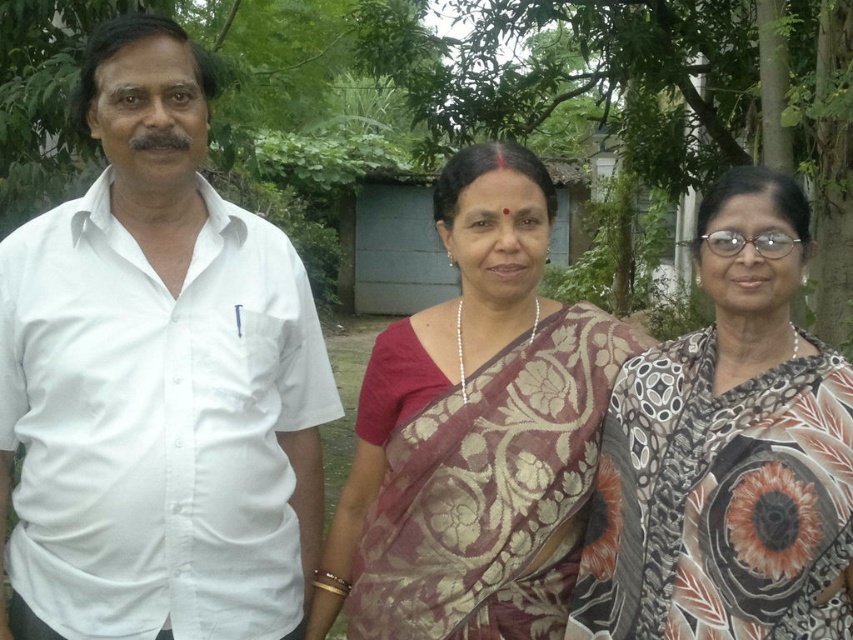
How far apart are maroon floral saree at center and green leafy tree at center?

maroon floral saree at center is 26.50 feet from green leafy tree at center.

Can you confirm if maroon floral saree at center is bigger than green leafy tree at center?

Yes.

Is point (495, 204) positioned behind point (711, 74)?

No, (495, 204) is closer to viewer.

At what (x,y) coordinates should I click in order to perform the action: click on maroon floral saree at center. Please return your answer as a coordinate pair (x, y). Looking at the image, I should click on (474, 432).

Does white cotton shirt at left have a lesser width compared to green leafy tree at center?

In fact, white cotton shirt at left might be wider than green leafy tree at center.

In order to click on white cotton shirt at left in this screenshot , I will do (x=157, y=380).

What do you see at coordinates (157, 380) in the screenshot?
I see `white cotton shirt at left` at bounding box center [157, 380].

This screenshot has width=853, height=640. What are the coordinates of `white cotton shirt at left` in the screenshot? It's located at (157, 380).

Can you confirm if maroon floral saree at center is positioned below printed silk saree at center?

Actually, maroon floral saree at center is above printed silk saree at center.

From the picture: Does maroon floral saree at center come behind printed silk saree at center?

Yes.

Find the location of a particular element. This screenshot has width=853, height=640. maroon floral saree at center is located at coordinates (474, 432).

You are a GUI agent. You are given a task and a screenshot of the screen. Output one action in this format:
    pyautogui.click(x=<x>, y=<y>)
    Task: Click on the maroon floral saree at center
    
    Given the screenshot: What is the action you would take?
    pyautogui.click(x=474, y=432)